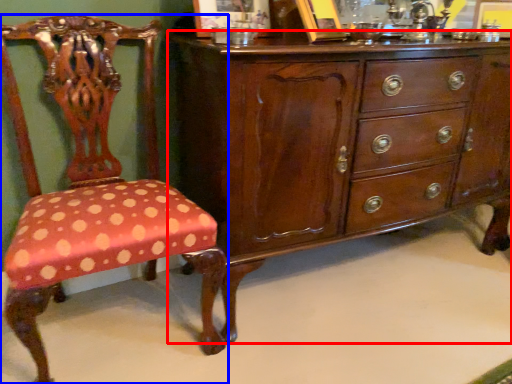
Question: Which object is further to the camera taking this photo, chest of drawers (highlighted by a red box) or chair (highlighted by a blue box)?

Choices:
 (A) chest of drawers
 (B) chair

Answer: (A)